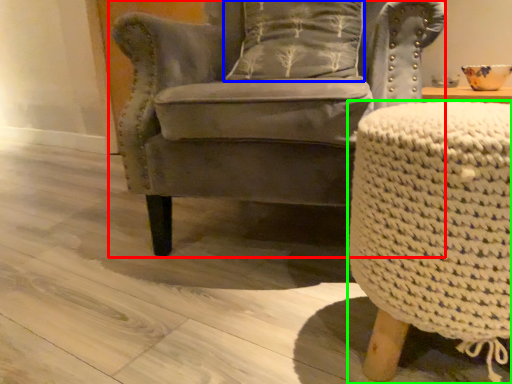
Question: Considering the real-world distances, which object is closest to chair (highlighted by a red box)? pillow (highlighted by a blue box) or table (highlighted by a green box).

Choices:
 (A) pillow
 (B) table

Answer: (A)